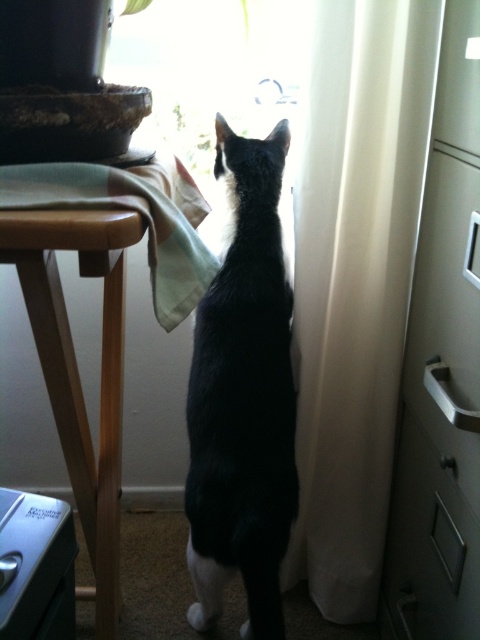
Is white sheer curtain at right above wooden table at left?

Yes, white sheer curtain at right is above wooden table at left.

Between point (391, 76) and point (107, 612), which one is positioned in front?

Point (107, 612) is more forward.

Image resolution: width=480 pixels, height=640 pixels. What do you see at coordinates (355, 280) in the screenshot?
I see `white sheer curtain at right` at bounding box center [355, 280].

Where is `white sheer curtain at right`? The width and height of the screenshot is (480, 640). white sheer curtain at right is located at coordinates (355, 280).

The height and width of the screenshot is (640, 480). Find the location of `white sheer curtain at right`. white sheer curtain at right is located at coordinates (355, 280).

Based on the photo, can you confirm if white sheer curtain at right is shorter than metallic silver file cabinet at lower left?

Incorrect, white sheer curtain at right's height does not fall short of metallic silver file cabinet at lower left's.

Who is more forward, (346, 154) or (28, 564)?

Point (28, 564)

Where is `white sheer curtain at right`? The height and width of the screenshot is (640, 480). white sheer curtain at right is located at coordinates (355, 280).

Between white sheer curtain at right and light green cotton cloth at left, which one has more height?

white sheer curtain at right

Can you confirm if white sheer curtain at right is positioned below light green cotton cloth at left?

Correct, white sheer curtain at right is located below light green cotton cloth at left.

Does point (379, 8) lie in front of point (180, 205)?

Yes, it is.

Identify the location of white sheer curtain at right. (355, 280).